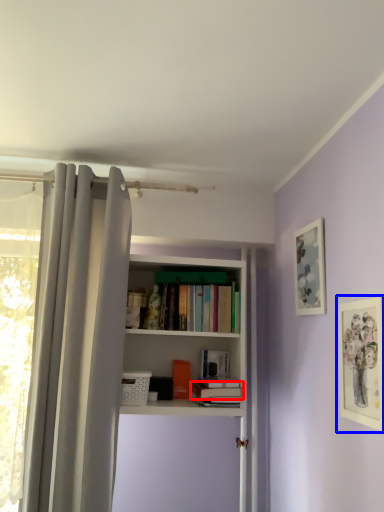
Question: Among these objects, which one is nearest to the camera, book (highlighted by a red box) or picture frame (highlighted by a blue box)?

Choices:
 (A) book
 (B) picture frame

Answer: (B)